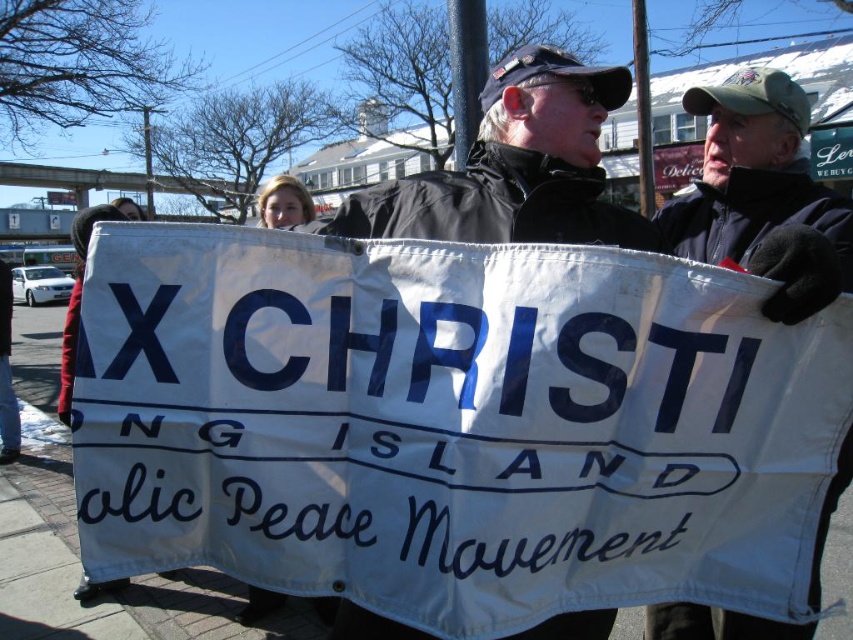
Question: Is black jacket at center smaller than black fleece jacket at center?

Choices:
 (A) yes
 (B) no

Answer: (A)

Question: Observing the image, what is the correct spatial positioning of black jacket at center in reference to black fleece jacket at center?

Choices:
 (A) left
 (B) right

Answer: (A)

Question: Considering the relative positions of black jacket at center and black fleece jacket at center in the image provided, where is black jacket at center located with respect to black fleece jacket at center?

Choices:
 (A) below
 (B) above

Answer: (B)

Question: Which point is closer to the camera taking this photo?

Choices:
 (A) (577, 161)
 (B) (849, 432)

Answer: (B)

Question: Which point is farther to the camera?

Choices:
 (A) black fleece jacket at center
 (B) black jacket at center

Answer: (B)

Question: Which object appears farthest from the camera in this image?

Choices:
 (A) black jacket at center
 (B) black fleece jacket at center

Answer: (A)